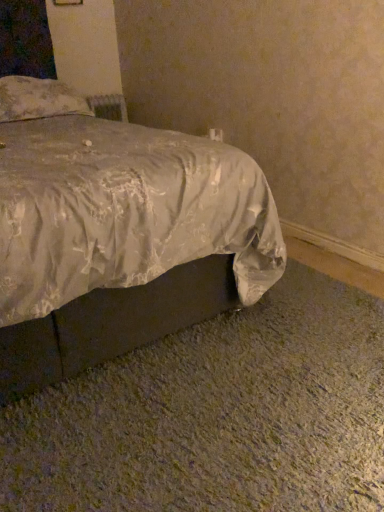
Identify the location of floral fabric pillow at upper left. The height and width of the screenshot is (512, 384). (38, 99).

Describe the element at coordinates (38, 99) in the screenshot. I see `floral fabric pillow at upper left` at that location.

This screenshot has width=384, height=512. What do you see at coordinates (121, 240) in the screenshot? I see `silvery satin bed at lower center` at bounding box center [121, 240].

This screenshot has width=384, height=512. In order to click on silvery satin bed at lower center in this screenshot , I will do `click(121, 240)`.

The image size is (384, 512). I want to click on floral fabric pillow at upper left, so click(x=38, y=99).

Between silvery satin bed at lower center and floral fabric pillow at upper left, which one appears on the right side from the viewer's perspective?

From the viewer's perspective, silvery satin bed at lower center appears more on the right side.

Is the position of silvery satin bed at lower center less distant than that of floral fabric pillow at upper left?

Yes, it is.

Is point (50, 162) farther from viewer compared to point (81, 103)?

No.

From the image's perspective, which is below, silvery satin bed at lower center or floral fabric pillow at upper left?

From the image's view, silvery satin bed at lower center is below.

From a real-world perspective, is silvery satin bed at lower center on top of floral fabric pillow at upper left?

Actually, silvery satin bed at lower center is physically below floral fabric pillow at upper left in the real world.

Is silvery satin bed at lower center wider than floral fabric pillow at upper left?

Yes, silvery satin bed at lower center is wider than floral fabric pillow at upper left.

Who is taller, silvery satin bed at lower center or floral fabric pillow at upper left?

With more height is silvery satin bed at lower center.

Which of these two, silvery satin bed at lower center or floral fabric pillow at upper left, is bigger?

silvery satin bed at lower center is bigger.

Is silvery satin bed at lower center located outside floral fabric pillow at upper left?

Yes, silvery satin bed at lower center is located beyond the bounds of floral fabric pillow at upper left.

Is silvery satin bed at lower center far from floral fabric pillow at upper left?

silvery satin bed at lower center is positioned a significant distance from floral fabric pillow at upper left.

Does silvery satin bed at lower center turn towards floral fabric pillow at upper left?

No, silvery satin bed at lower center is not turned towards floral fabric pillow at upper left.

Consider the image. How distant is silvery satin bed at lower center from floral fabric pillow at upper left?

The distance of silvery satin bed at lower center from floral fabric pillow at upper left is 3.79 feet.

Locate an element on the screen. The image size is (384, 512). pillow that is above the silvery satin bed at lower center (from a real-world perspective) is located at coordinates (38, 99).

Based on the photo, based on their positions, is floral fabric pillow at upper left located to the left or right of silvery satin bed at lower center?

floral fabric pillow at upper left is to the left of silvery satin bed at lower center.

Relative to silvery satin bed at lower center, is floral fabric pillow at upper left in front or behind?

In the image, floral fabric pillow at upper left appears behind silvery satin bed at lower center.

Considering the positions of points (73, 94) and (115, 193), is point (73, 94) closer to camera compared to point (115, 193)?

No, it is behind (115, 193).

From the image's perspective, which object appears higher, floral fabric pillow at upper left or silvery satin bed at lower center?

floral fabric pillow at upper left, from the image's perspective.

In the scene shown: From a real-world perspective, which object stands above the other?

floral fabric pillow at upper left, from a real-world perspective.

Considering the relative sizes of floral fabric pillow at upper left and silvery satin bed at lower center in the image provided, is floral fabric pillow at upper left wider than silvery satin bed at lower center?

No, floral fabric pillow at upper left is not wider than silvery satin bed at lower center.

Looking at this image, is floral fabric pillow at upper left taller than silvery satin bed at lower center?

No.

Based on their sizes in the image, would you say floral fabric pillow at upper left is bigger or smaller than silvery satin bed at lower center?

In the image, floral fabric pillow at upper left appears to be smaller than silvery satin bed at lower center.

Consider the image. Would you say floral fabric pillow at upper left is outside silvery satin bed at lower center?

That's incorrect, floral fabric pillow at upper left is not completely outside silvery satin bed at lower center.

Is floral fabric pillow at upper left far from silvery satin bed at lower center?

Yes, floral fabric pillow at upper left and silvery satin bed at lower center are quite far apart.

Is floral fabric pillow at upper left facing away from silvery satin bed at lower center?

That's right, floral fabric pillow at upper left is facing away from silvery satin bed at lower center.

How many degrees apart are the facing directions of floral fabric pillow at upper left and silvery satin bed at lower center?

The angle between the facing direction of floral fabric pillow at upper left and the facing direction of silvery satin bed at lower center is 0.418 degrees.

Find the location of a particular element. The image size is (384, 512). pillow located above the silvery satin bed at lower center (from a real-world perspective) is located at coordinates (38, 99).

The width and height of the screenshot is (384, 512). In order to click on pillow above the silvery satin bed at lower center (from a real-world perspective) in this screenshot , I will do `click(38, 99)`.

Where is `pillow on the left of silvery satin bed at lower center`? The image size is (384, 512). pillow on the left of silvery satin bed at lower center is located at coordinates (38, 99).